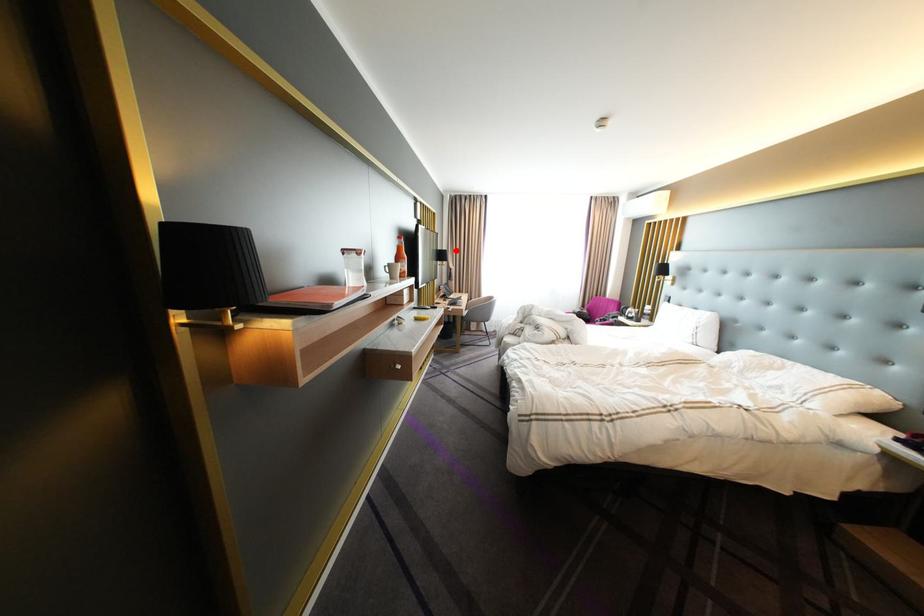
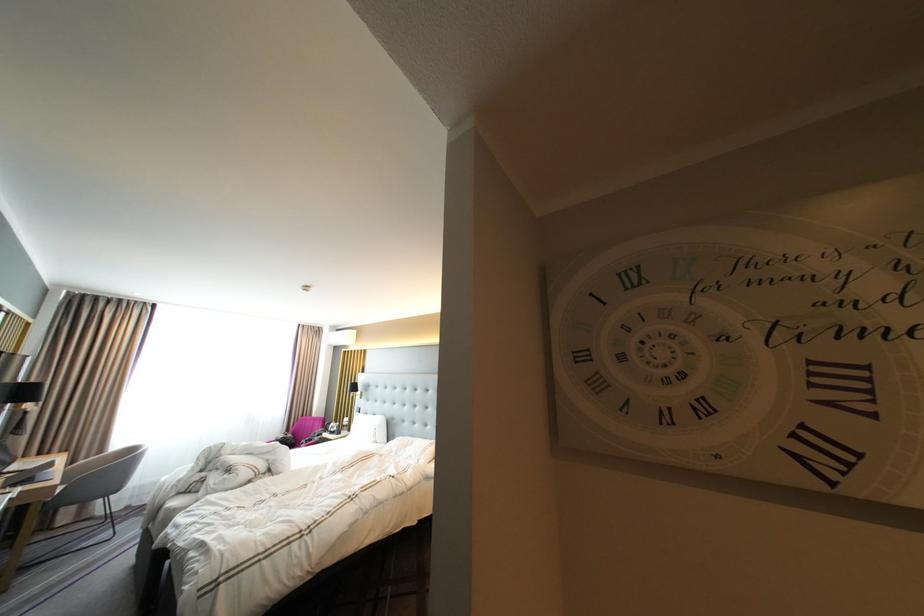
Question: I am providing you with two images of the same scene from different viewpoints. In image1, a red point is highlighted. Considering the same 3D point in image2, which of the following is correct?

Choices:
 (A) It is closer
 (B) It is farther

Answer: (B)